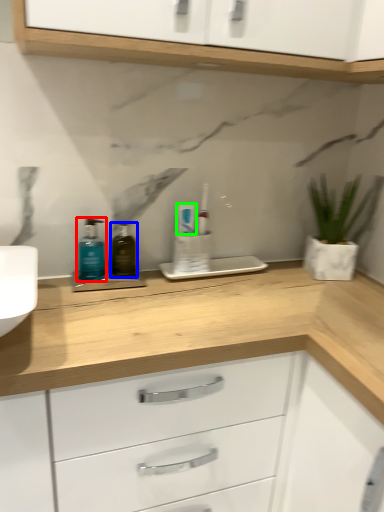
Question: Considering the real-world distances, which object is closest to toiletry (highlighted by a red box)? mouthwash (highlighted by a blue box) or toothpaste (highlighted by a green box).

Choices:
 (A) mouthwash
 (B) toothpaste

Answer: (A)